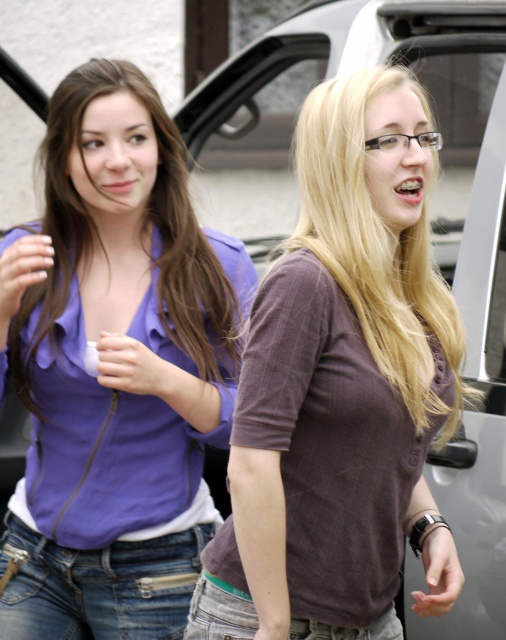
Who is more distant from viewer, (213,237) or (328,100)?

Positioned behind is point (213,237).

Does purple satin blouse at upper left appear on the right side of matte purple blouse at center?

Incorrect, purple satin blouse at upper left is not on the right side of matte purple blouse at center.

Who is more forward, (54, 131) or (322, 243)?

Point (322, 243)

Find the location of a particular element. purple satin blouse at upper left is located at coordinates tap(114, 369).

Is the position of matte purple blouse at center more distant than that of denim jeans at lower center?

No.

From the picture: Does matte purple blouse at center appear on the right side of denim jeans at lower center?

Yes, matte purple blouse at center is to the right of denim jeans at lower center.

This screenshot has height=640, width=506. What do you see at coordinates (372, 243) in the screenshot?
I see `matte purple blouse at center` at bounding box center [372, 243].

This screenshot has width=506, height=640. I want to click on matte purple blouse at center, so click(x=372, y=243).

Is matte purple blouse at center wider than jeans at lower left?

In fact, matte purple blouse at center might be narrower than jeans at lower left.

This screenshot has width=506, height=640. What do you see at coordinates (372, 243) in the screenshot? I see `matte purple blouse at center` at bounding box center [372, 243].

The image size is (506, 640). What do you see at coordinates (372, 243) in the screenshot?
I see `matte purple blouse at center` at bounding box center [372, 243].

Identify the location of matte purple blouse at center. (372, 243).